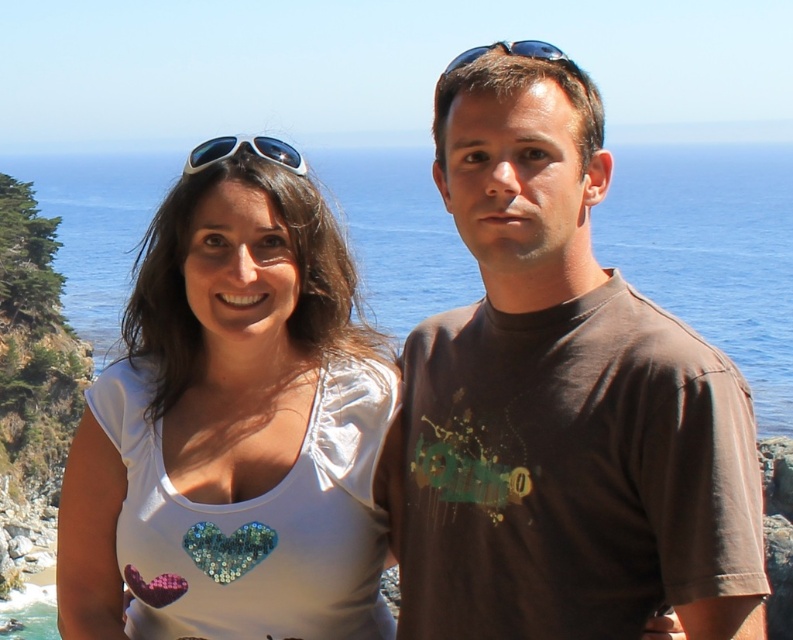
From the picture: Can you confirm if blue water at center is thinner than black plastic sunglasses at upper center?

No, blue water at center is not thinner than black plastic sunglasses at upper center.

Can you confirm if blue water at center is positioned to the right of black plastic sunglasses at upper center?

In fact, blue water at center is to the left of black plastic sunglasses at upper center.

Is point (634, 198) farther from viewer compared to point (565, 58)?

Yes, point (634, 198) is farther from viewer.

The width and height of the screenshot is (793, 640). What are the coordinates of `blue water at center` in the screenshot? It's located at (711, 252).

Which is more to the right, brown cotton t-shirt at right or white sequined heart at center?

brown cotton t-shirt at right is more to the right.

Where is `brown cotton t-shirt at right`? Image resolution: width=793 pixels, height=640 pixels. brown cotton t-shirt at right is located at coordinates (562, 401).

Image resolution: width=793 pixels, height=640 pixels. What do you see at coordinates (562, 401) in the screenshot?
I see `brown cotton t-shirt at right` at bounding box center [562, 401].

Does point (596, 452) come in front of point (527, 48)?

Yes, it is in front of point (527, 48).

You are a GUI agent. You are given a task and a screenshot of the screen. Output one action in this format:
    pyautogui.click(x=<x>, y=<y>)
    Task: Click on the brown cotton t-shirt at right
    The image size is (793, 640).
    Given the screenshot: What is the action you would take?
    pyautogui.click(x=562, y=401)